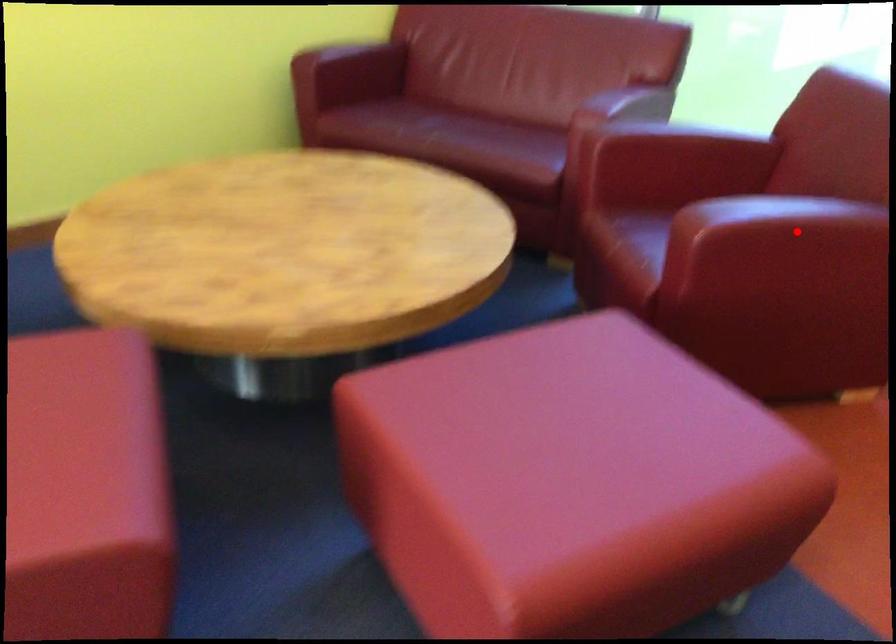
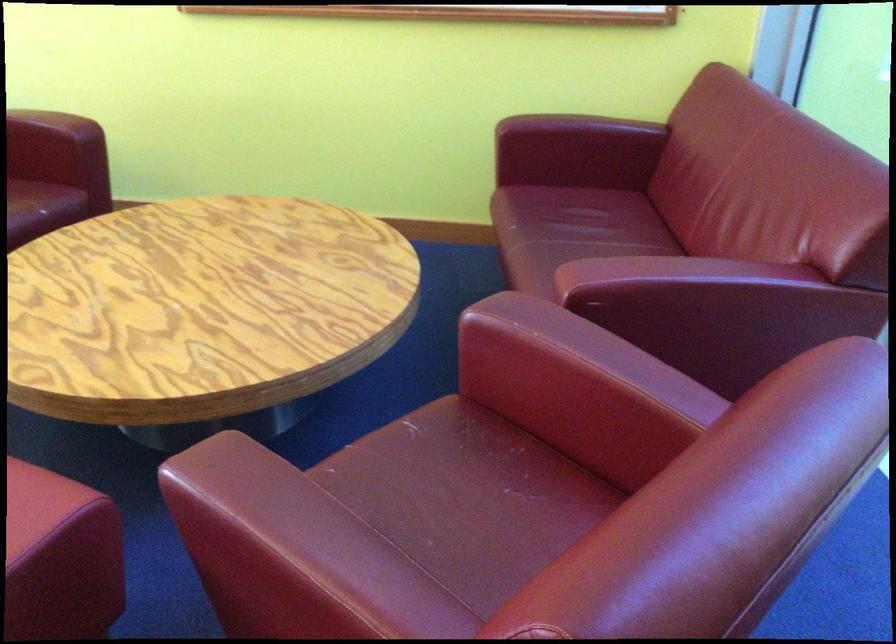
In the second image, find the point that corresponds to the highlighted location in the first image.

(261, 542)